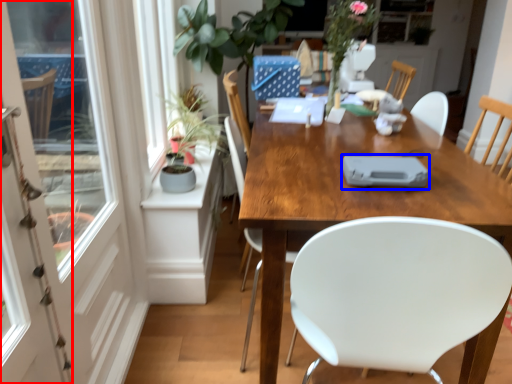
Question: Which object is closer to the camera taking this photo, screen door (highlighted by a red box) or tableware (highlighted by a blue box)?

Choices:
 (A) screen door
 (B) tableware

Answer: (A)